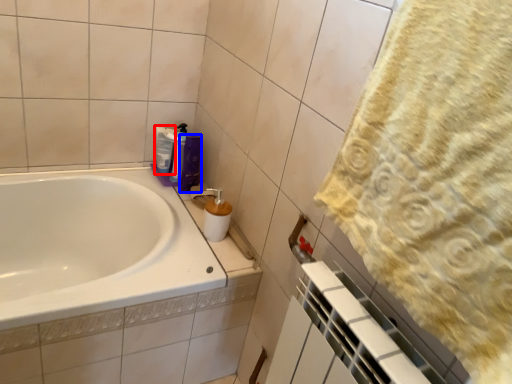
Question: Which object appears farthest to the camera in this image, cleaning product (highlighted by a red box) or toiletry (highlighted by a blue box)?

Choices:
 (A) cleaning product
 (B) toiletry

Answer: (A)